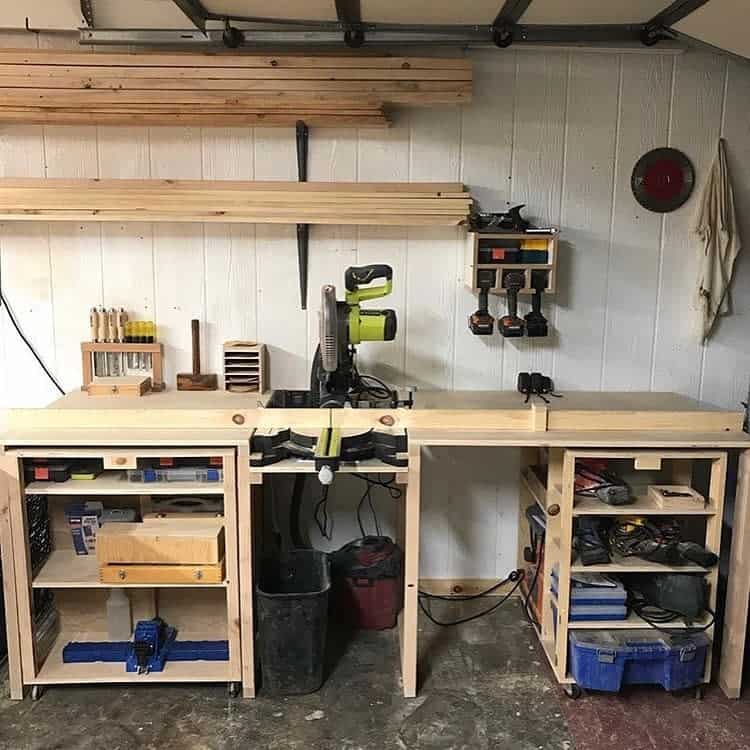
What are the coordinates of `garbage can` in the screenshot? It's located at (286, 622).